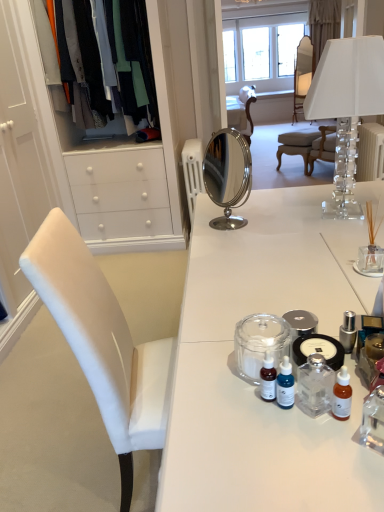
Question: From a real-world perspective, is transparent glass jar at center positioned under silky cotton shirts at upper left based on gravity?

Choices:
 (A) no
 (B) yes

Answer: (B)

Question: Is transparent glass jar at center oriented away from silky cotton shirts at upper left?

Choices:
 (A) yes
 (B) no

Answer: (B)

Question: Does transparent glass jar at center lie in front of silky cotton shirts at upper left?

Choices:
 (A) yes
 (B) no

Answer: (A)

Question: Is transparent glass jar at center touching silky cotton shirts at upper left?

Choices:
 (A) no
 (B) yes

Answer: (A)

Question: Does transparent glass jar at center have a lesser width compared to silky cotton shirts at upper left?

Choices:
 (A) no
 (B) yes

Answer: (B)

Question: Is light brown wooden chair at center, which is the second chair from top to bottom, in front of or behind transparent glass jar at center in the image?

Choices:
 (A) front
 (B) behind

Answer: (B)

Question: Considering the positions of point (329, 160) and point (274, 354), is point (329, 160) closer or farther from the camera than point (274, 354)?

Choices:
 (A) closer
 (B) farther

Answer: (B)

Question: From the image's perspective, is light brown wooden chair at center, positioned as the 2th chair in right-to-left order, above or below transparent glass jar at center?

Choices:
 (A) above
 (B) below

Answer: (A)

Question: Is light brown wooden chair at center, which is the 1th chair in front-to-back order, spatially inside transparent glass jar at center, or outside of it?

Choices:
 (A) inside
 (B) outside

Answer: (B)

Question: Considering the positions of clear crystal lampshade at upper right and white fabric curtain at upper center in the image, is clear crystal lampshade at upper right wider or thinner than white fabric curtain at upper center?

Choices:
 (A) wide
 (B) thin

Answer: (A)

Question: Is clear crystal lampshade at upper right in front of or behind white fabric curtain at upper center in the image?

Choices:
 (A) behind
 (B) front

Answer: (B)

Question: Is clear crystal lampshade at upper right bigger or smaller than white fabric curtain at upper center?

Choices:
 (A) big
 (B) small

Answer: (B)

Question: Is point (369, 45) positioned closer to the camera than point (337, 4)?

Choices:
 (A) closer
 (B) farther

Answer: (A)

Question: From the image's perspective, is matte white chair at center, which is the 2th chair in front-to-back order, above or below white fabric curtain at upper center?

Choices:
 (A) above
 (B) below

Answer: (B)

Question: In the image, is matte white chair at center, which is the 2th chair in front-to-back order, positioned in front of or behind white fabric curtain at upper center?

Choices:
 (A) behind
 (B) front

Answer: (B)